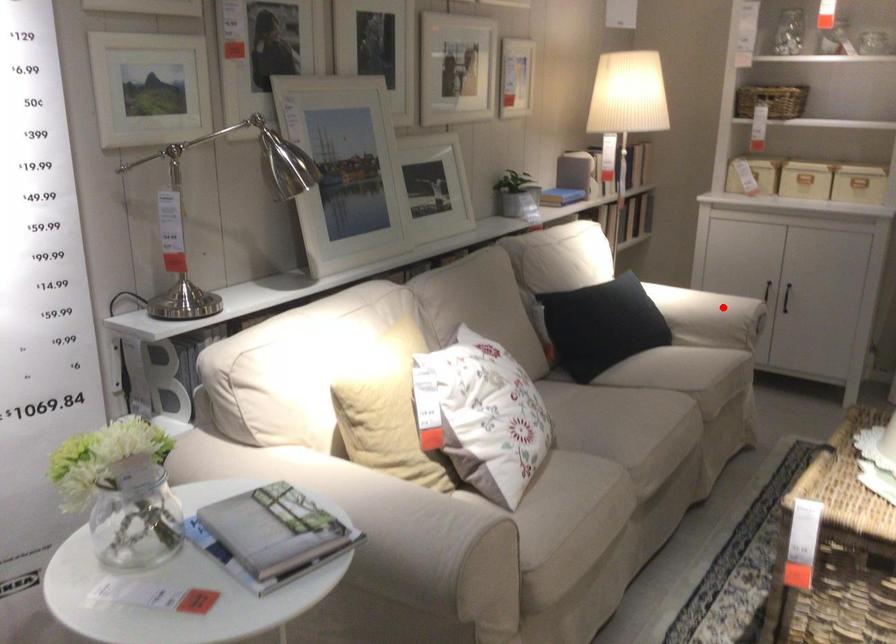
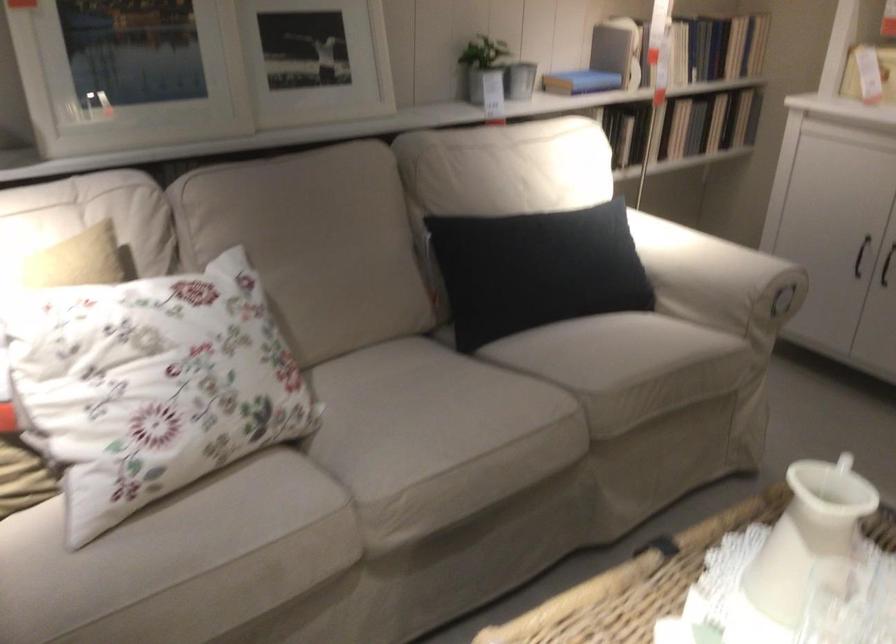
Question: A red point is marked in image1. In image2, is the corresponding 3D point closer to the camera or farther? Reply with the corresponding letter.

Choices:
 (A) The corresponding 3D point is closer.
 (B) The corresponding 3D point is farther.

Answer: (A)